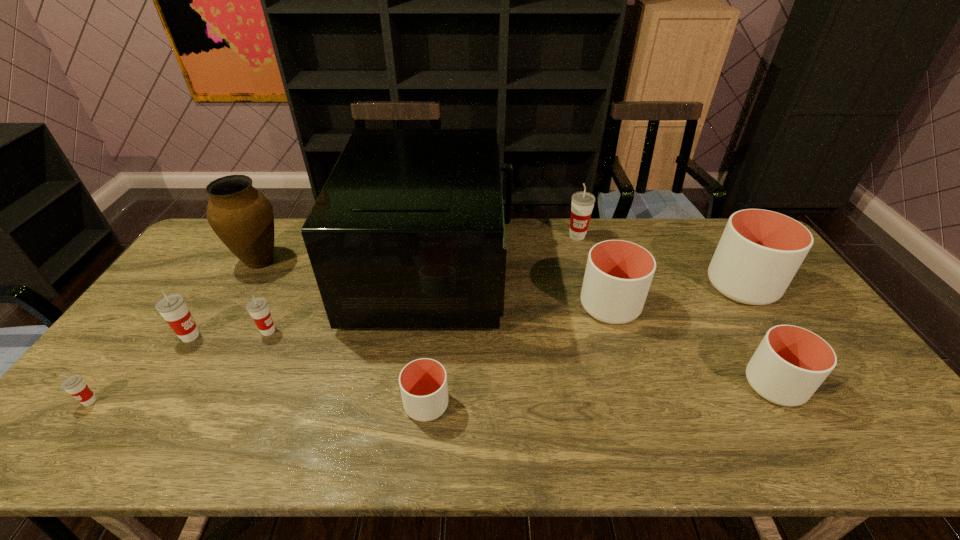
This screenshot has width=960, height=540. Identify the location of urn that is positioned at the left edge. pyautogui.click(x=242, y=217).

Identify the location of object at the right edge. This screenshot has width=960, height=540. (760, 251).

Identify the location of object situated at the far left corner. This screenshot has width=960, height=540. (242, 217).

The width and height of the screenshot is (960, 540). Find the location of `free space at the far edge of the desktop`. free space at the far edge of the desktop is located at coordinates (672, 250).

You are a GUI agent. You are given a task and a screenshot of the screen. Output one action in this format:
    pyautogui.click(x=<x>, y=<y>)
    Task: Click on the free spot at the near edge of the desktop
    
    Given the screenshot: What is the action you would take?
    pyautogui.click(x=372, y=432)

Identify the location of free space between the biggest white cup and the second smallest white cup. (758, 335).

Find the location of a particular element. The width and height of the screenshot is (960, 540). vacant region between the fourth cup from left to right and the third biggest white cup is located at coordinates (600, 395).

At what (x,y) coordinates should I click in order to perform the action: click on vacant area that lies between the second smallest white cup and the third biggest red cup. Please return your answer as a coordinate pair (x, y). Looking at the image, I should click on (521, 358).

Identify the location of free space between the leftmost cup and the biggest white cup. The height and width of the screenshot is (540, 960). (416, 343).

Identify the location of free space between the sixth cup from right to left and the third biggest white cup. Image resolution: width=960 pixels, height=540 pixels. (521, 358).